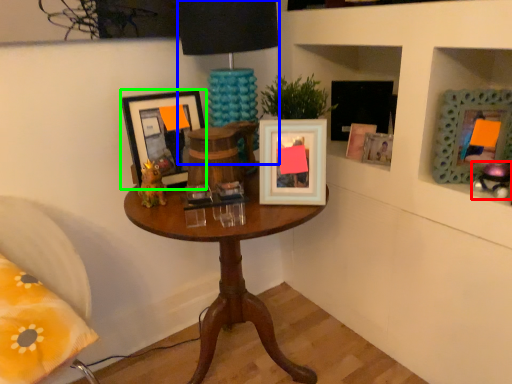
Question: Considering the real-world distances, which object is farthest from toy (highlighted by a red box)? table lamp (highlighted by a blue box) or picture frame (highlighted by a green box)?

Choices:
 (A) table lamp
 (B) picture frame

Answer: (B)